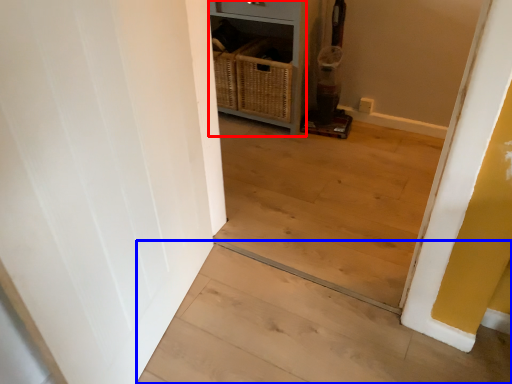
Question: Which of the following is the closest to the observer, dresser (highlighted by a red box) or stairwell (highlighted by a blue box)?

Choices:
 (A) dresser
 (B) stairwell

Answer: (B)